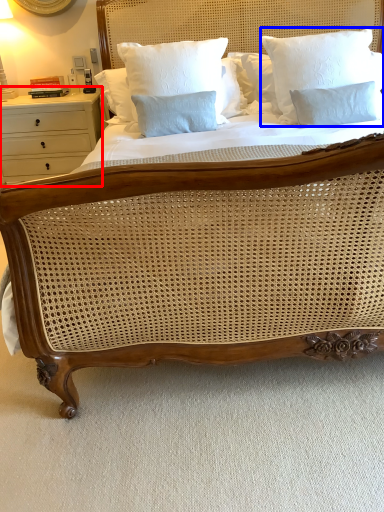
Question: Which object appears closest to the camera in this image, nightstand (highlighted by a red box) or pillow (highlighted by a blue box)?

Choices:
 (A) nightstand
 (B) pillow

Answer: (B)